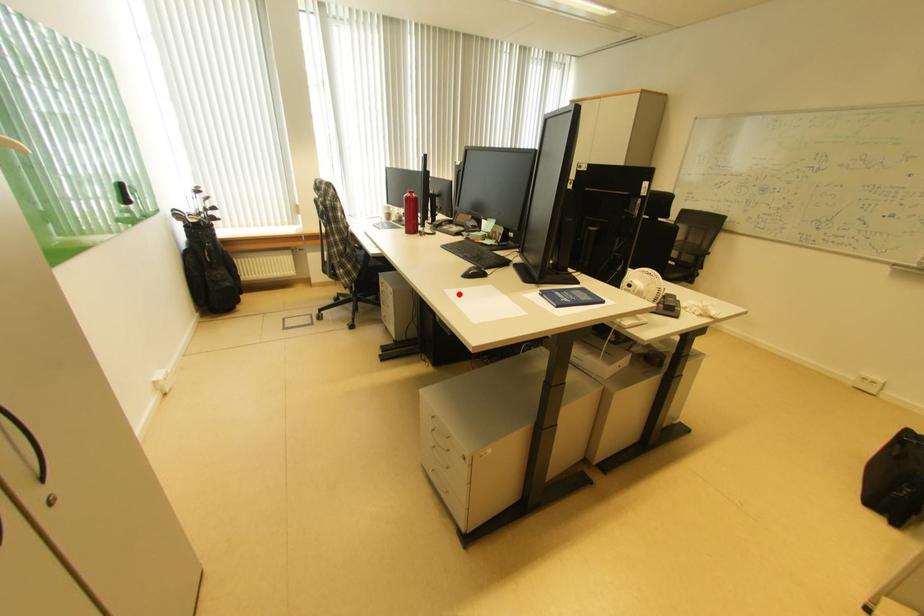
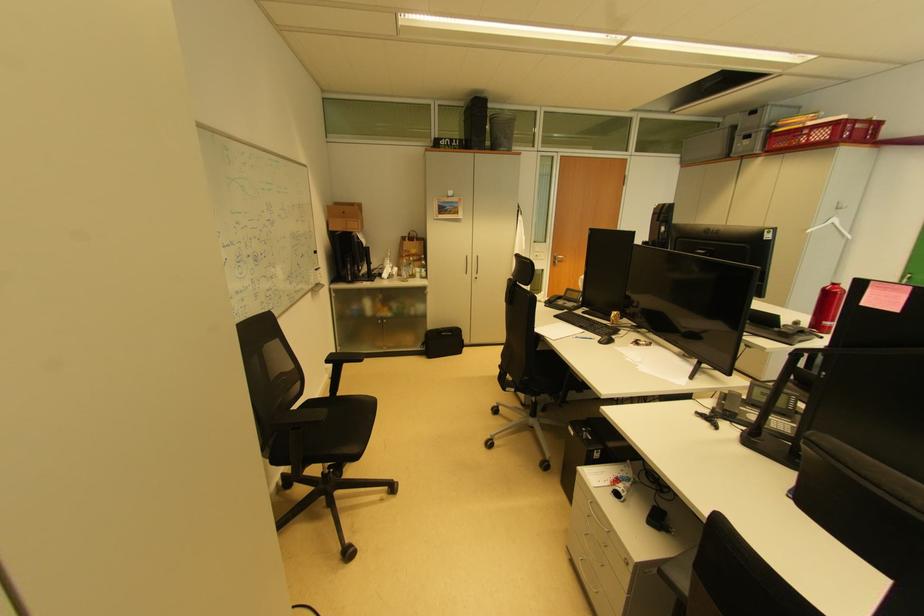
Question: I am providing you with two images of the same scene from different viewpoints. A red point is marked on the first image. Can you still see the location of the red point in image 2?

Choices:
 (A) Yes
 (B) No

Answer: (B)